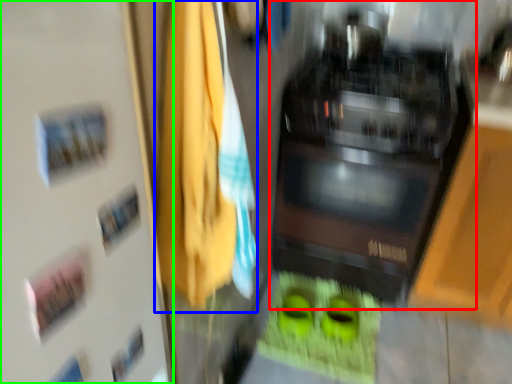
Question: Estimate the real-world distances between objects in this image. Which object is farther from home appliance (highlighted by a red box), laundry (highlighted by a blue box) or door (highlighted by a green box)?

Choices:
 (A) laundry
 (B) door

Answer: (B)